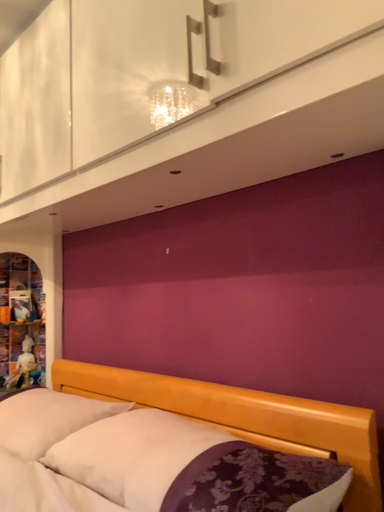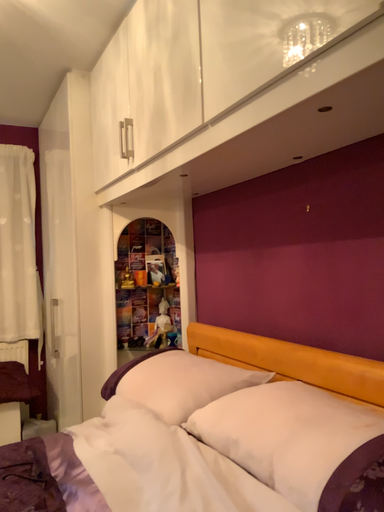
Question: Which way did the camera rotate in the video?

Choices:
 (A) rotated left
 (B) rotated right

Answer: (A)